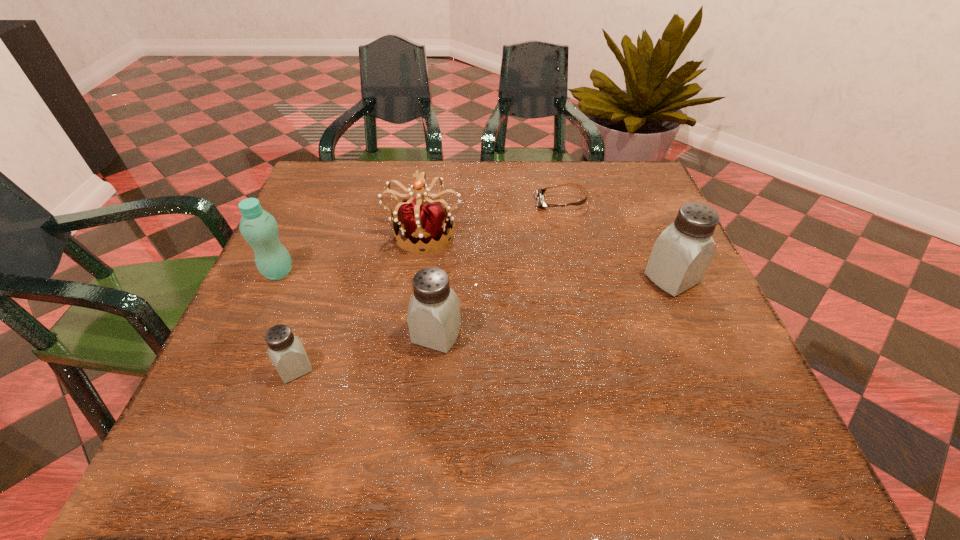
This screenshot has width=960, height=540. In order to click on vacant area located on the left of the second tallest saltshaker in this screenshot , I will do `click(297, 335)`.

At what (x,y) coordinates should I click in order to perform the action: click on vacant space located on the back of the rightmost saltshaker. Please return your answer as a coordinate pair (x, y). The image size is (960, 540). Looking at the image, I should click on tap(626, 171).

This screenshot has height=540, width=960. What are the coordinates of `free space located 0.390m on the front-facing side of the shortest object` in the screenshot? It's located at (385, 202).

You are a GUI agent. You are given a task and a screenshot of the screen. Output one action in this format:
    pyautogui.click(x=<x>, y=<y>)
    Task: Click on the vacant area situated on the front-facing side of the shortest object
    This screenshot has width=960, height=540.
    Given the screenshot: What is the action you would take?
    pyautogui.click(x=400, y=202)

Where is `free region located on the front-facing side of the shortest object`? free region located on the front-facing side of the shortest object is located at coordinates (470, 202).

You are a GUI agent. You are given a task and a screenshot of the screen. Output one action in this format:
    pyautogui.click(x=<x>, y=<y>)
    Task: Click on the vacant area situated on the right of the leftmost object
    This screenshot has height=540, width=960.
    Given the screenshot: What is the action you would take?
    pyautogui.click(x=386, y=272)

Where is `free location located 0.300m on the front-facing side of the tiara`? This screenshot has height=540, width=960. free location located 0.300m on the front-facing side of the tiara is located at coordinates (404, 370).

Identify the location of goggles that is at the far edge. (539, 192).

Find the location of a particular element. Image resolution: width=960 pixels, height=540 pixels. tiara positioned at the far edge is located at coordinates (427, 223).

I want to click on object situated at the near edge, so click(x=285, y=350).